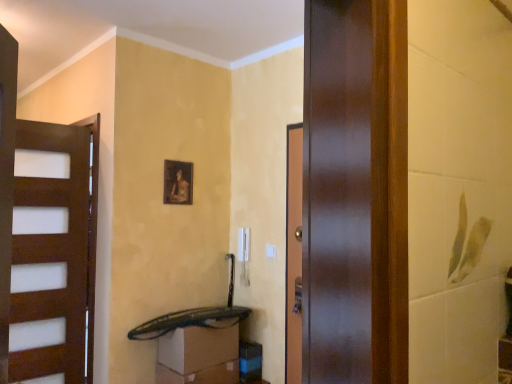
Question: Considering the relative sizes of black plastic drawer at lower center, placed as the 1th drawer when sorted from top to bottom, and matte wooden picture frame at center in the image provided, is black plastic drawer at lower center, placed as the 1th drawer when sorted from top to bottom, wider than matte wooden picture frame at center?

Choices:
 (A) no
 (B) yes

Answer: (B)

Question: Can you see black plastic drawer at lower center, placed as the 1th drawer when sorted from top to bottom, touching matte wooden picture frame at center?

Choices:
 (A) yes
 (B) no

Answer: (B)

Question: From the image's perspective, does black plastic drawer at lower center, placed as the 1th drawer when sorted from top to bottom, appear lower than matte wooden picture frame at center?

Choices:
 (A) no
 (B) yes

Answer: (B)

Question: Is black plastic drawer at lower center, which is the 2th drawer in bottom-to-top order, shorter than matte wooden picture frame at center?

Choices:
 (A) no
 (B) yes

Answer: (B)

Question: Is matte wooden picture frame at center a part of black plastic drawer at lower center, placed as the 1th drawer when sorted from top to bottom?

Choices:
 (A) yes
 (B) no

Answer: (B)

Question: Is matte wooden picture frame at center at the back of black plastic drawer at lower center, which is the 2th drawer in bottom-to-top order?

Choices:
 (A) yes
 (B) no

Answer: (B)

Question: From a real-world perspective, is matte white drawer at lower center, which appears as the 2th drawer when viewed from the top, located higher than matte wooden picture frame at center?

Choices:
 (A) yes
 (B) no

Answer: (B)

Question: Can you confirm if matte white drawer at lower center, which appears as the 2th drawer when viewed from the top, is positioned to the right of matte wooden picture frame at center?

Choices:
 (A) yes
 (B) no

Answer: (A)

Question: Is matte white drawer at lower center, which appears as the 2th drawer when viewed from the top, surrounding matte wooden picture frame at center?

Choices:
 (A) no
 (B) yes

Answer: (A)

Question: From the image's perspective, would you say matte white drawer at lower center, which appears as the 2th drawer when viewed from the top, is shown under matte wooden picture frame at center?

Choices:
 (A) no
 (B) yes

Answer: (B)

Question: Is the position of matte white drawer at lower center, which appears as the 2th drawer when viewed from the top, less distant than that of matte wooden picture frame at center?

Choices:
 (A) no
 (B) yes

Answer: (B)

Question: Does matte white drawer at lower center, which appears as the 2th drawer when viewed from the top, have a greater width compared to black plastic drawer at lower center, placed as the 1th drawer when sorted from top to bottom?

Choices:
 (A) yes
 (B) no

Answer: (A)